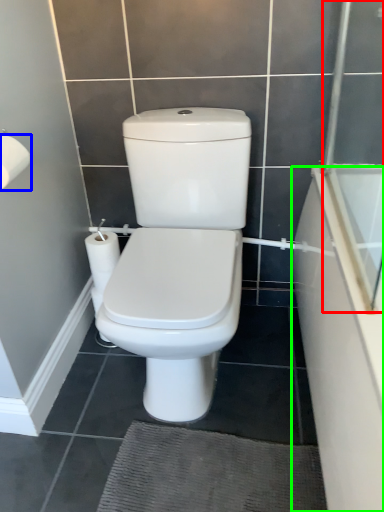
Question: Which object is the closest to the screen door (highlighted by a red box)? Choose among these: toilet paper (highlighted by a blue box) or bath (highlighted by a green box).

Choices:
 (A) toilet paper
 (B) bath

Answer: (B)